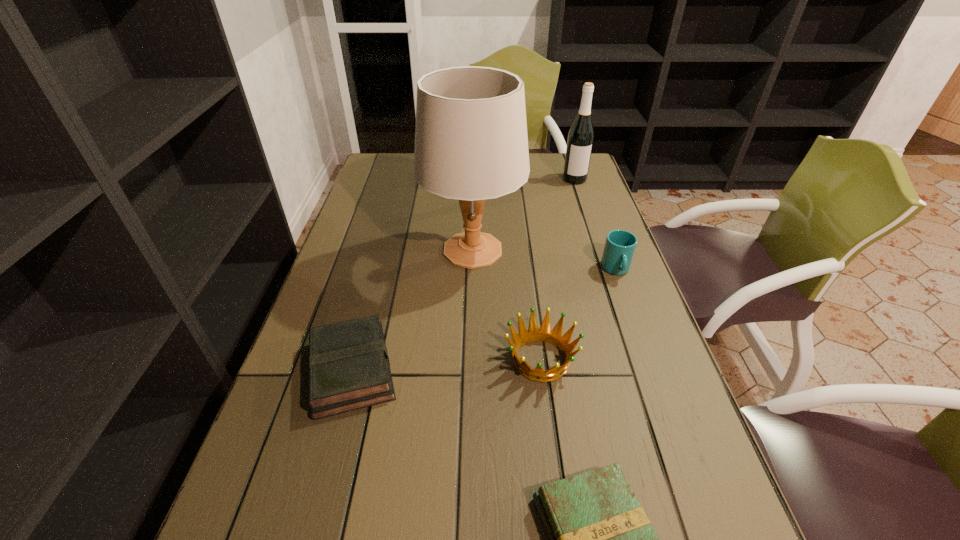
Find the location of a particular element. The image size is (960, 540). free space located on the left of the crown is located at coordinates (339, 359).

In order to click on vacant space located on the right of the left book in this screenshot , I will do `click(444, 370)`.

This screenshot has height=540, width=960. Find the location of `object positioned at the far edge`. object positioned at the far edge is located at coordinates (581, 135).

You are a GUI agent. You are given a task and a screenshot of the screen. Output one action in this format:
    pyautogui.click(x=<x>, y=<y>)
    Task: Click on the object at the left edge
    Image resolution: width=960 pixels, height=540 pixels.
    Given the screenshot: What is the action you would take?
    pyautogui.click(x=349, y=369)

Identify the location of wine bottle that is at the right edge. (581, 135).

I want to click on cup situated at the right edge, so click(620, 245).

Find the location of a particular element. The image size is (960, 540). object at the far right corner is located at coordinates 581,135.

Where is `free spot at the left edge of the desktop`? free spot at the left edge of the desktop is located at coordinates (385, 240).

Where is `free location at the right edge of the desktop`? free location at the right edge of the desktop is located at coordinates (604, 230).

Image resolution: width=960 pixels, height=540 pixels. In the image, there is a desktop. Find the location of `vacant space at the far left corner`. vacant space at the far left corner is located at coordinates (390, 173).